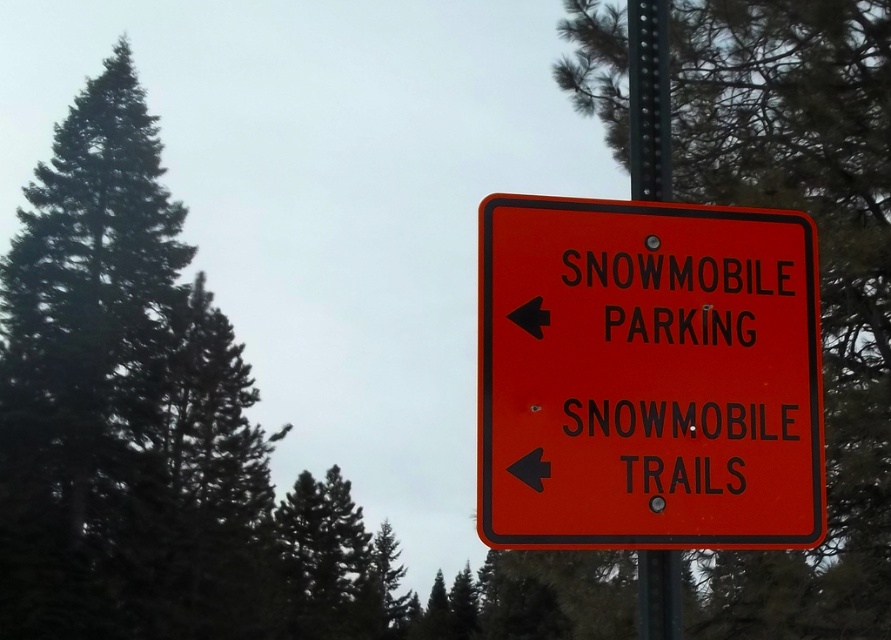
Question: Is orange plastic sign at center above green textured pine tree at upper right?

Choices:
 (A) yes
 (B) no

Answer: (B)

Question: Estimate the real-world distances between objects in this image. Which object is closer to the metallic pole at center?

Choices:
 (A) green textured pine tree at upper right
 (B) orange plastic sign at center

Answer: (B)

Question: Among these objects, which one is farthest from the camera?

Choices:
 (A) orange plastic sign at center
 (B) green textured pine tree at upper right

Answer: (B)

Question: Considering the real-world distances, which object is closest to the green textured pine tree at upper right?

Choices:
 (A) metallic pole at center
 (B) orange plastic sign at center

Answer: (B)

Question: In this image, where is orange plastic sign at center located relative to metallic pole at center?

Choices:
 (A) left
 (B) right

Answer: (A)

Question: Does orange plastic sign at center appear on the right side of metallic pole at center?

Choices:
 (A) no
 (B) yes

Answer: (A)